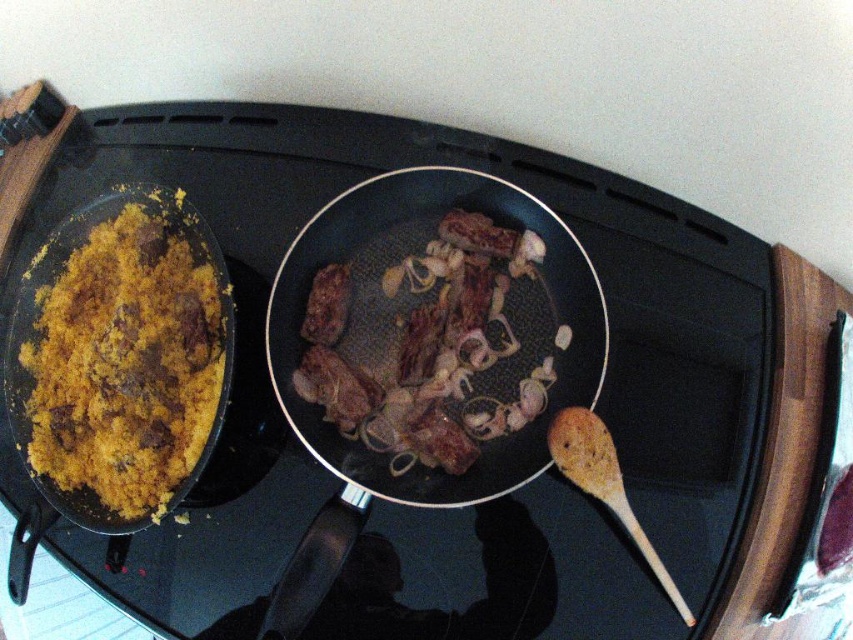
Consider the image. Does yellow rice at left appear over brown matte meat at center?

No, yellow rice at left is not above brown matte meat at center.

Measure the distance between yellow rice at left and brown matte meat at center.

yellow rice at left and brown matte meat at center are 5.66 inches apart from each other.

Find the location of a particular element. This screenshot has width=853, height=640. yellow rice at left is located at coordinates pyautogui.click(x=120, y=358).

Between shiny black wok at center and brown matte meat at center, which one appears on the right side from the viewer's perspective?

Positioned to the right is brown matte meat at center.

This screenshot has height=640, width=853. In order to click on shiny black wok at center in this screenshot , I will do `click(425, 353)`.

Is point (480, 298) in front of point (486, 282)?

Yes, it is in front of point (486, 282).

I want to click on shiny black wok at center, so click(425, 353).

Does shiny black wok at center have a greater height compared to wooden spoon at lower right?

Yes, shiny black wok at center is taller than wooden spoon at lower right.

Which of these two, shiny black wok at center or wooden spoon at lower right, stands taller?

Standing taller between the two is shiny black wok at center.

Which is behind, point (308, 584) or point (613, 506)?

Positioned behind is point (613, 506).

Locate an element on the screen. shiny black wok at center is located at coordinates (425, 353).